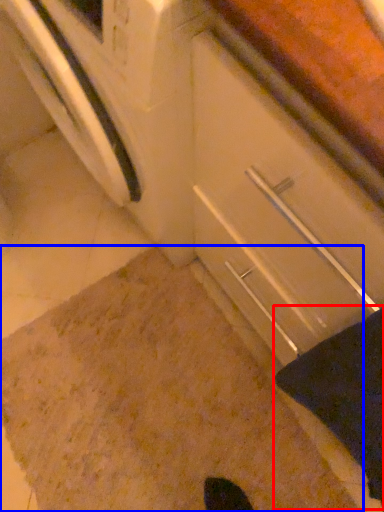
Question: Among these objects, which one is farthest to the camera, blanket (highlighted by a red box) or granite (highlighted by a blue box)?

Choices:
 (A) blanket
 (B) granite

Answer: (B)